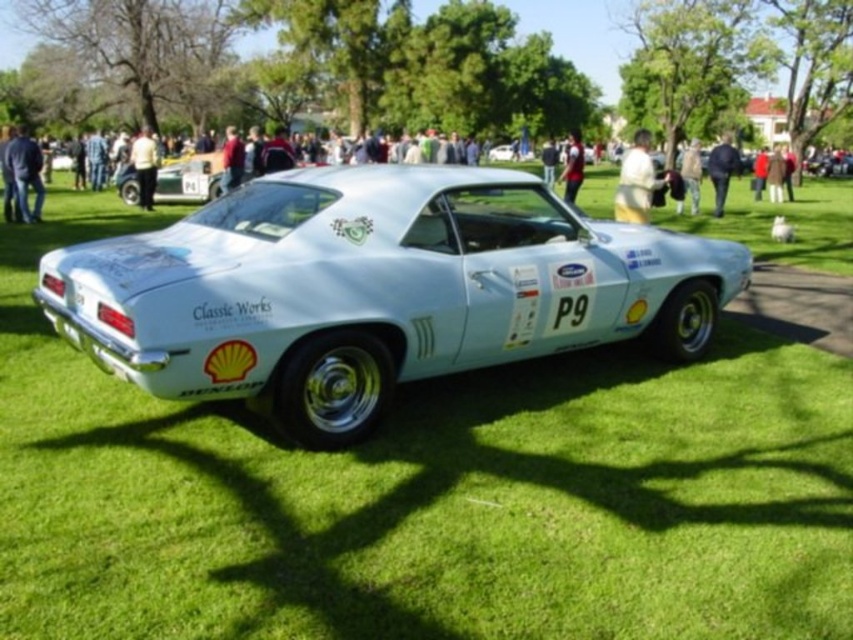
You are a photographer standing in front of the vintage light blue muscle car. You notice the blue denim jeans at lower left and the white shirt at center. Which clothing item is positioned higher from the ground?

The blue denim jeans at lower left is located above the white shirt at center, so it is positioned higher from the ground.

Consider the image. You are a photographer setting up a shoot with a vintage light blue muscle car. You have a white fabric shirt at upper center and a light blue fabric jacket at center. Which clothing item has a smaller width?

The white fabric shirt at upper center has a smaller width than the light blue fabric jacket at center according to the description.

You are standing at the camera position and want to reach the point marked as point [689,163]. If your walking speed is 1.5 meters per second, how long will it take you to reach that point?

The distance of point [689,163] from camera is 15.89 meters. At a speed of 1.5 meters per second, it would take approximately 10.59 seconds to reach the point.